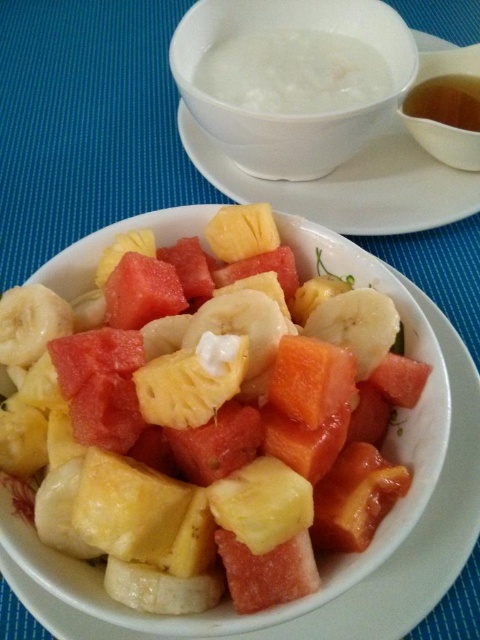
Question: Is white matte bowl at upper center smaller than translucent brown liquid at upper right?

Choices:
 (A) yes
 (B) no

Answer: (B)

Question: Estimate the real-world distances between objects in this image. Which object is closer to the white porcelain bowl at upper center?

Choices:
 (A) white creamy soup at upper center
 (B) yellowish matte pineapple at center

Answer: (A)

Question: Does white creamy soup at upper center have a greater width compared to translucent brown liquid at upper right?

Choices:
 (A) yes
 (B) no

Answer: (A)

Question: Is white porcelain bowl at upper center smaller than white creamy soup at upper center?

Choices:
 (A) yes
 (B) no

Answer: (B)

Question: Which object appears closest to the camera in this image?

Choices:
 (A) translucent brown liquid at upper right
 (B) white porcelain bowl at upper center

Answer: (B)

Question: Which point is farther from the camera taking this photo?

Choices:
 (A) (222, 109)
 (B) (245, 64)
 (C) (439, 99)

Answer: (C)